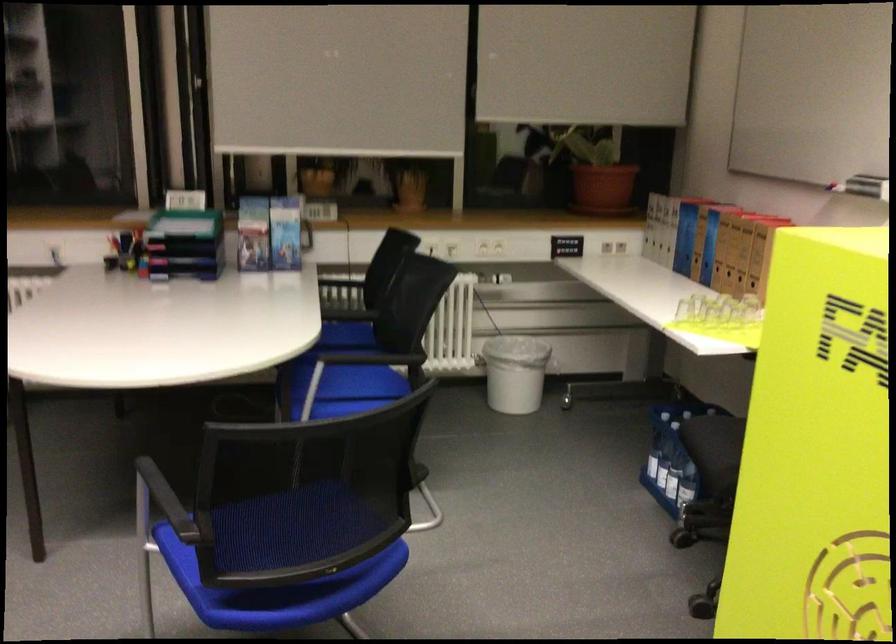
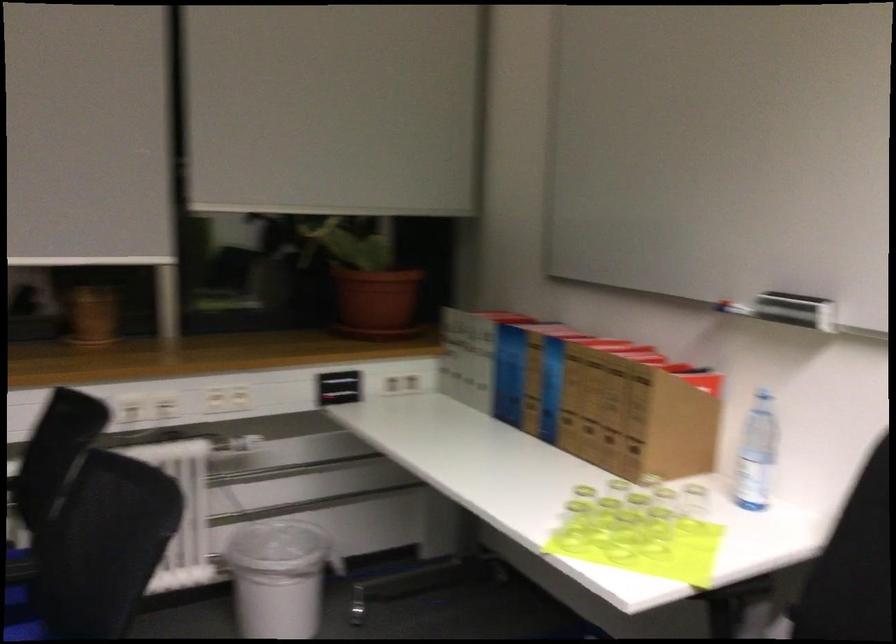
In the second image, find the point that corresponds to (x=599, y=185) in the first image.

(375, 303)